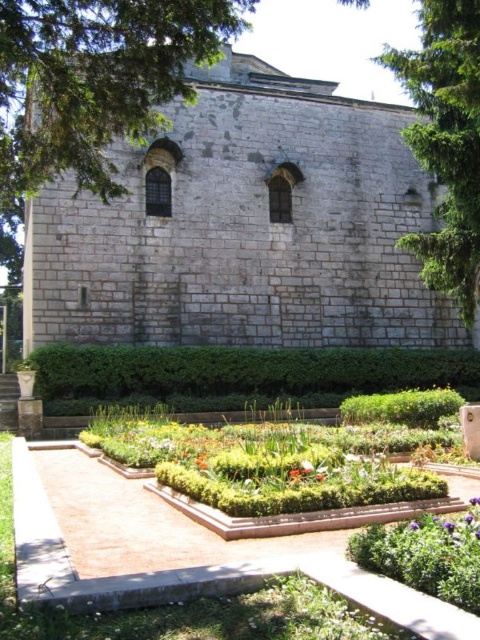
Question: Which object is the closest to the green leafy hedge at center?

Choices:
 (A) green leafy tree at upper right
 (B) white stone chapel at center

Answer: (B)

Question: Is white stone chapel at center to the right of green leafy hedge at center from the viewer's perspective?

Choices:
 (A) no
 (B) yes

Answer: (B)

Question: Is white stone chapel at center wider than green leafy hedge at center?

Choices:
 (A) yes
 (B) no

Answer: (A)

Question: Which point is farther to the camera?

Choices:
 (A) (69, 358)
 (B) (414, 188)

Answer: (B)

Question: Is white stone chapel at center closer to camera compared to green leafy hedge at center?

Choices:
 (A) yes
 (B) no

Answer: (B)

Question: Which object is positioned closest to the green leafy tree at upper right?

Choices:
 (A) green leafy hedge at center
 (B) white stone chapel at center

Answer: (B)